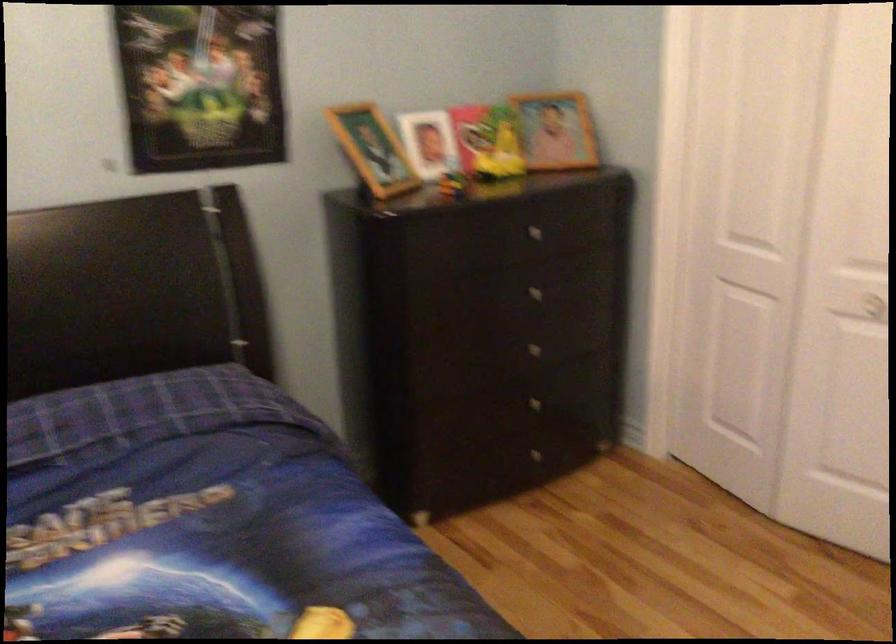
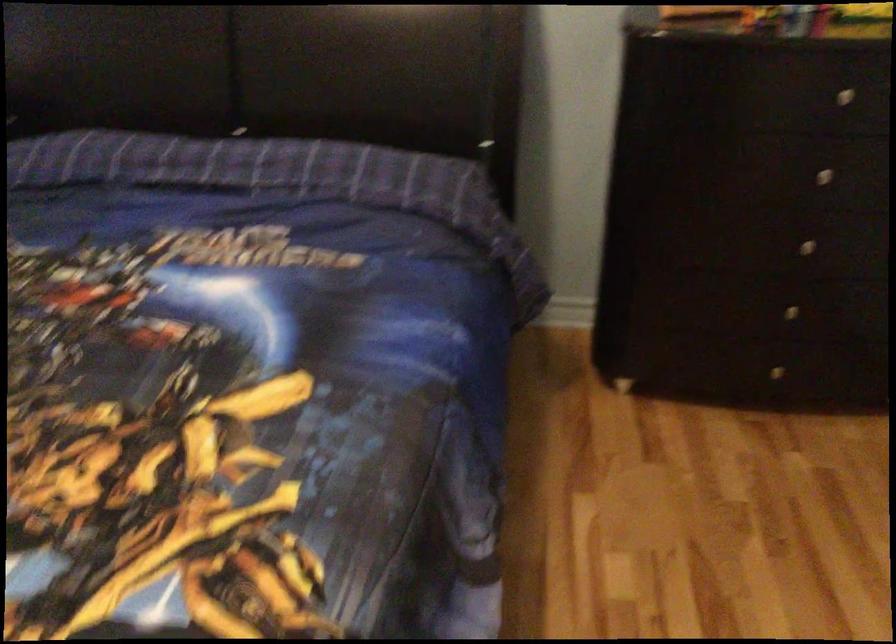
Based on the continuous images, in which direction is the camera rotating?

The rotation direction of the camera is left-down.